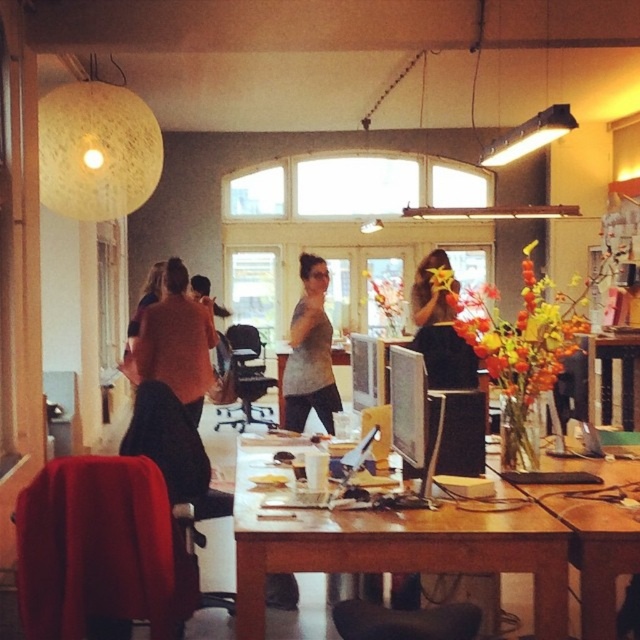
Question: Which point is farther from the camera taking this photo?

Choices:
 (A) (154, 355)
 (B) (307, 369)
 (C) (593, 608)
 (D) (458, 371)

Answer: (B)

Question: Is wooden desk at center bigger than matte gray sweater at center?

Choices:
 (A) yes
 (B) no

Answer: (A)

Question: Can you confirm if wooden desk at center is bigger than matte pink shirt at center?

Choices:
 (A) yes
 (B) no

Answer: (B)

Question: Is wooden table at center wider than matte pink shirt at center?

Choices:
 (A) no
 (B) yes

Answer: (B)

Question: Which object appears closest to the camera in this image?

Choices:
 (A) wooden desk at center
 (B) matte gray sweater at center

Answer: (A)

Question: Which point appears closest to the camera in this image?

Choices:
 (A) (154, 337)
 (B) (572, 497)

Answer: (B)